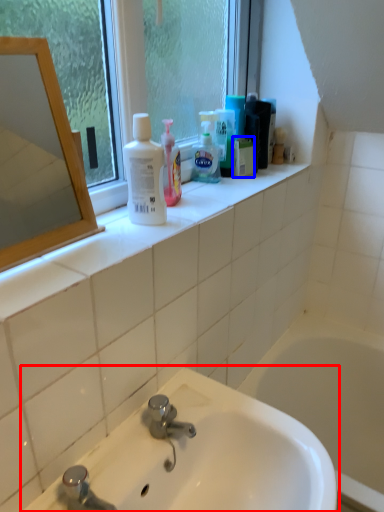
Question: Which point is closer to the camera, sink (highlighted by a red box) or mouthwash (highlighted by a blue box)?

Choices:
 (A) sink
 (B) mouthwash

Answer: (A)